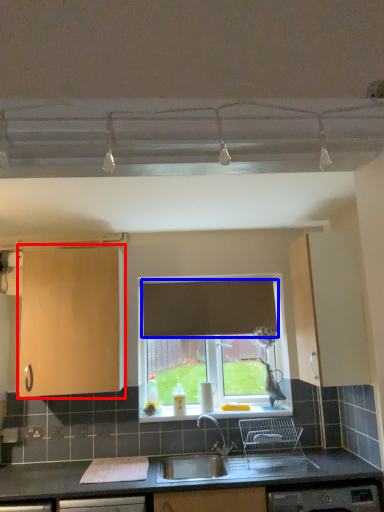
Question: Among these objects, which one is farthest to the camera, cabinetry (highlighted by a red box) or curtain (highlighted by a blue box)?

Choices:
 (A) cabinetry
 (B) curtain

Answer: (B)